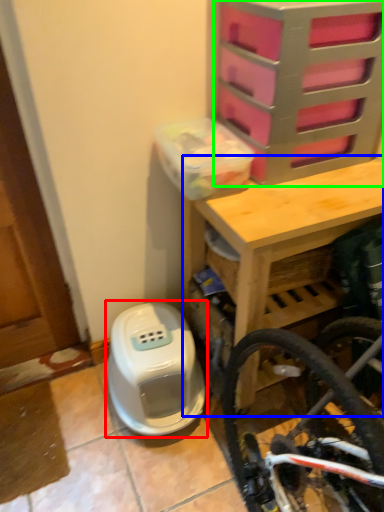
Question: Which is nearer to the water heater (highlighted by a red box)? table (highlighted by a blue box) or drawer (highlighted by a green box).

Choices:
 (A) table
 (B) drawer

Answer: (A)